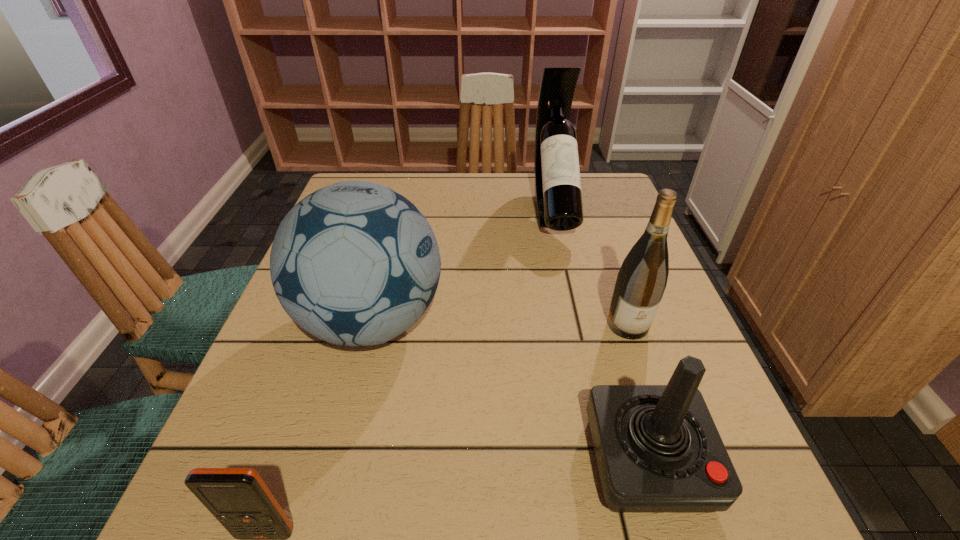
This screenshot has height=540, width=960. Identify the location of object located in the near edge section of the desktop. (658, 450).

The height and width of the screenshot is (540, 960). I want to click on object located at the left edge, so click(x=355, y=263).

The width and height of the screenshot is (960, 540). I want to click on joystick at the right edge, so click(x=658, y=450).

Locate an element on the screen. object that is positioned at the far right corner is located at coordinates (558, 196).

The image size is (960, 540). I want to click on object at the near right corner, so click(658, 450).

This screenshot has height=540, width=960. Find the location of `free region at the far edge of the desktop`. free region at the far edge of the desktop is located at coordinates (502, 195).

Find the location of `vacant space at the near edge of the desktop`. vacant space at the near edge of the desktop is located at coordinates pos(342,518).

In the image, there is a desktop. In order to click on free space at the right edge in this screenshot , I will do `click(660, 316)`.

At what (x,y) coordinates should I click in order to perform the action: click on free space at the far left corner of the desktop. Please return your answer as a coordinate pair (x, y). Looking at the image, I should click on coord(366,176).

In order to click on blank space at the far right corner of the desktop in this screenshot , I will do `click(608, 192)`.